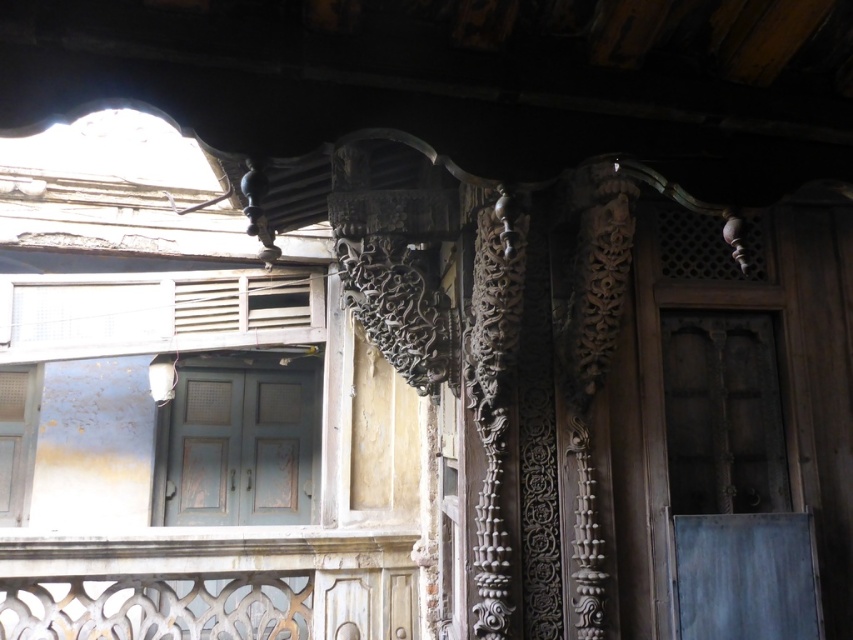
Can you confirm if matte blue door at center is positioned above white painted wood at lower left?

No.

Who is more forward, (268, 476) or (22, 401)?

Point (22, 401)

At what (x,y) coordinates should I click in order to perform the action: click on matte blue door at center. Please return your answer as a coordinate pair (x, y). The height and width of the screenshot is (640, 853). Looking at the image, I should click on (241, 448).